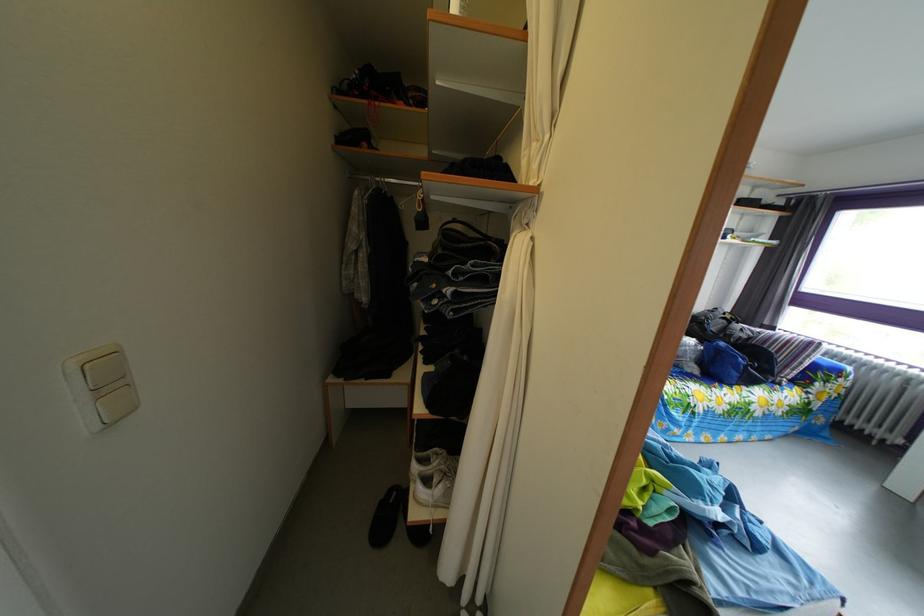
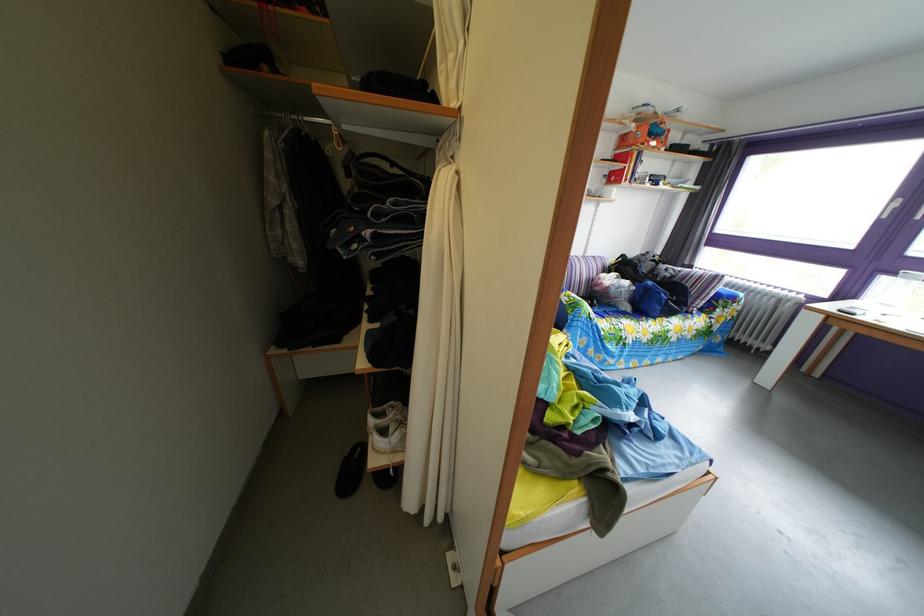
Question: The images are taken continuously from a first-person perspective. In which direction are you moving?

Choices:
 (A) Left
 (B) Right
 (C) Forward
 (D) Backward

Answer: (B)